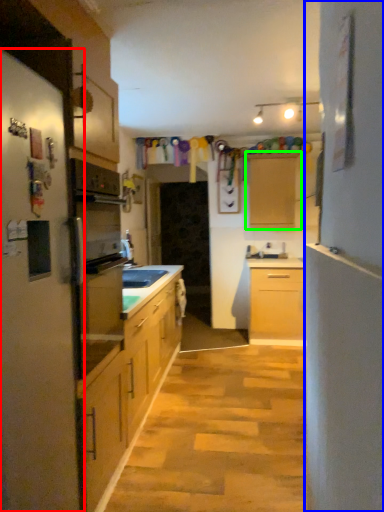
Question: Which is nearer to the fridge (highlighted by a red box)? side (highlighted by a blue box) or cabinetry (highlighted by a green box).

Choices:
 (A) side
 (B) cabinetry

Answer: (A)